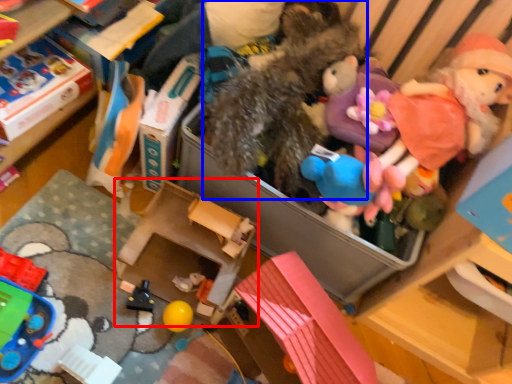
Question: Among these objects, which one is farthest to the camera, storage box (highlighted by a red box) or toy (highlighted by a blue box)?

Choices:
 (A) storage box
 (B) toy

Answer: (A)